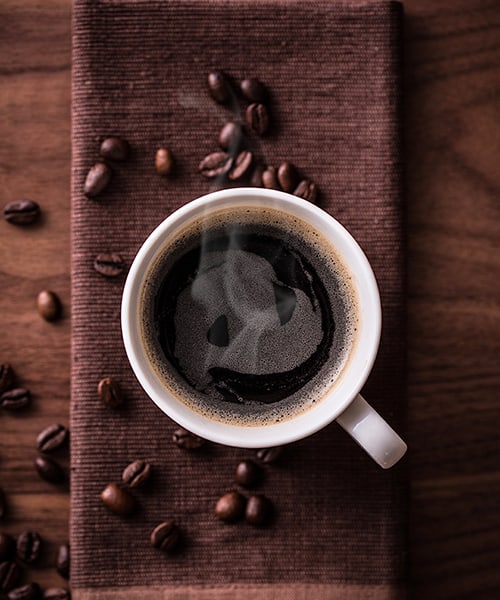
In order to click on white coffee cup in this screenshot , I will do `click(370, 350)`.